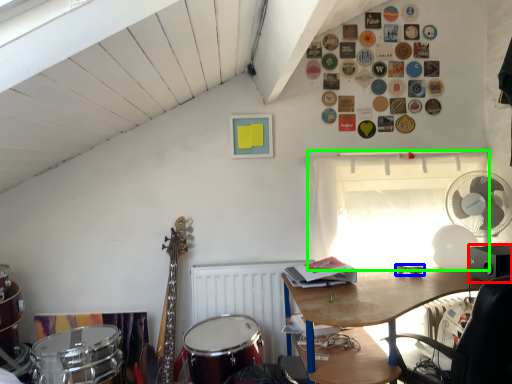
Question: Which is farther away from loudspeaker (highlighted by a red box)? glasses (highlighted by a blue box) or window (highlighted by a green box)?

Choices:
 (A) glasses
 (B) window

Answer: (B)